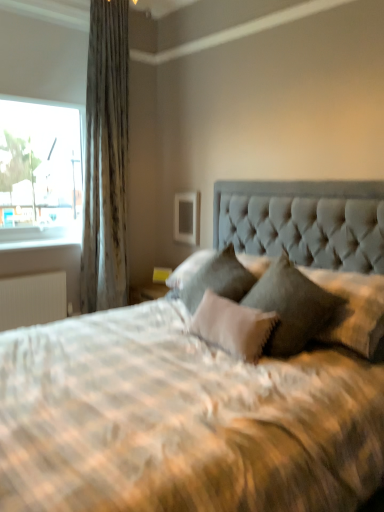
Question: Relative to velvet gray pillow at center, which ranks as the third pillow in left-to-right order, is white plastic window sill at left in front or behind?

Choices:
 (A) behind
 (B) front

Answer: (A)

Question: From the image's perspective, is white plastic window sill at left positioned above or below velvet gray pillow at center, placed as the 1th pillow when sorted from right to left?

Choices:
 (A) above
 (B) below

Answer: (A)

Question: Based on their relative distances, which object is nearer to the velvet gray pillow at center, the 3th pillow in the right-to-left sequence?

Choices:
 (A) white textured pillow at center, which appears as the second pillow when viewed from the right
 (B) satin fabric curtain at left
 (C) white plastic window sill at left
 (D) velvet gray pillow at center, placed as the 1th pillow when sorted from right to left
 (E) white matte radiator at lower left

Answer: (A)

Question: Considering the real-world distances, which object is closest to the white textured pillow at center, which appears as the second pillow when viewed from the right?

Choices:
 (A) white plastic window sill at left
 (B) satin fabric curtain at left
 (C) white matte radiator at lower left
 (D) velvet gray pillow at center, the 1th pillow from the left
 (E) velvet gray pillow at center, which ranks as the third pillow in left-to-right order

Answer: (D)